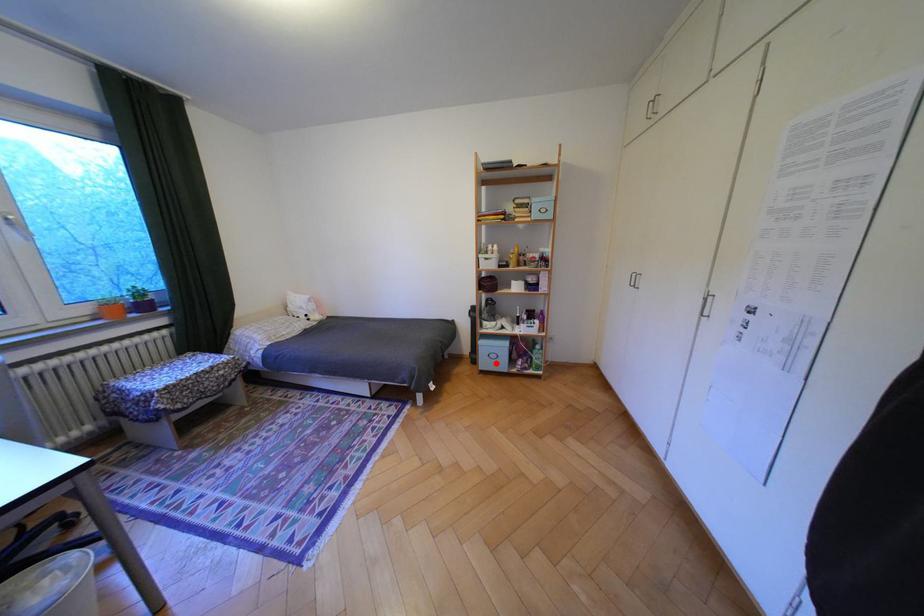
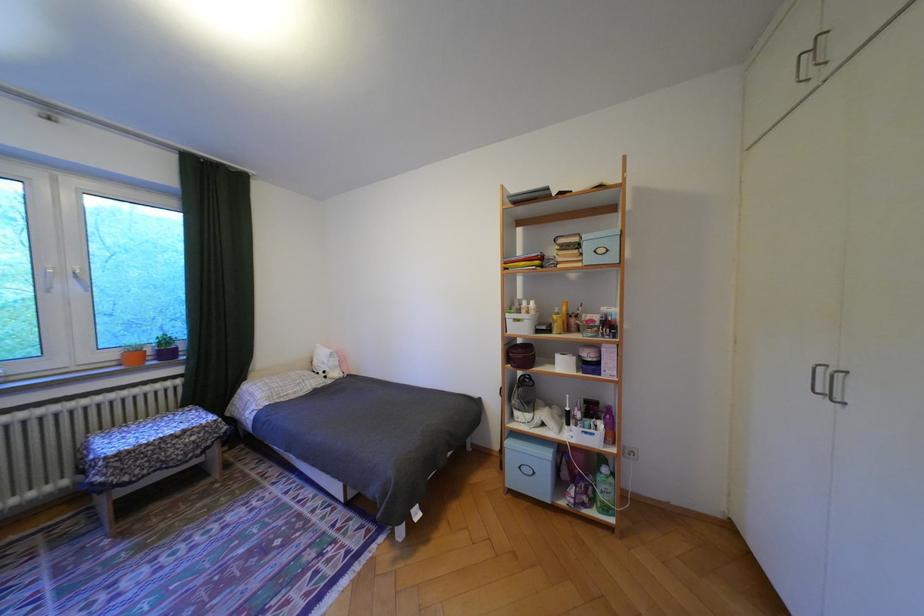
Question: A red point is marked in image1. In image2, is the corresponding 3D point closer to the camera or farther? Reply with the corresponding letter.

Choices:
 (A) The corresponding 3D point is closer.
 (B) The corresponding 3D point is farther.

Answer: (B)